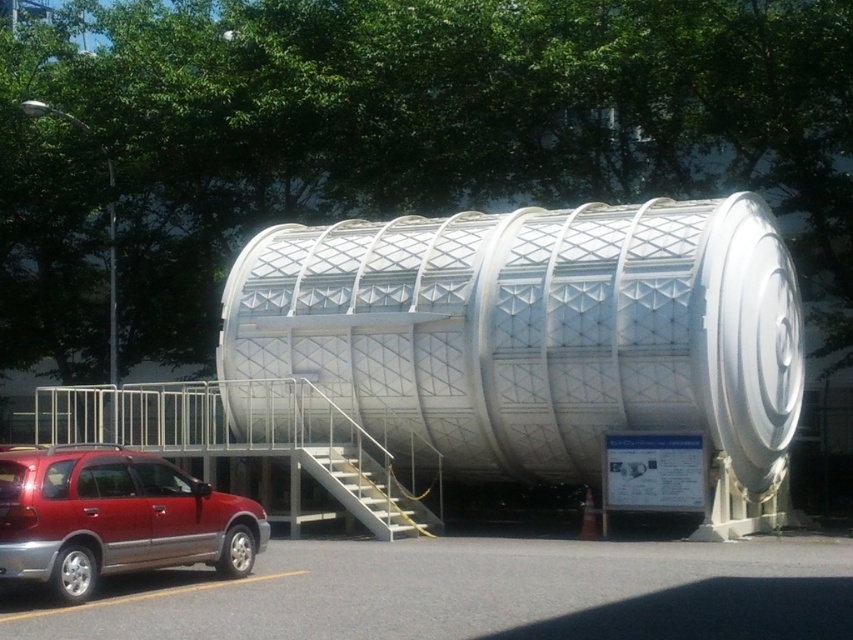
Between point (358, 289) and point (51, 552), which one is positioned behind?

The point (358, 289) is more distant.

Measure the distance between white metallic tank at center and camera.

white metallic tank at center and camera are 58.43 feet apart.

The width and height of the screenshot is (853, 640). Find the location of `white metallic tank at center`. white metallic tank at center is located at coordinates (537, 333).